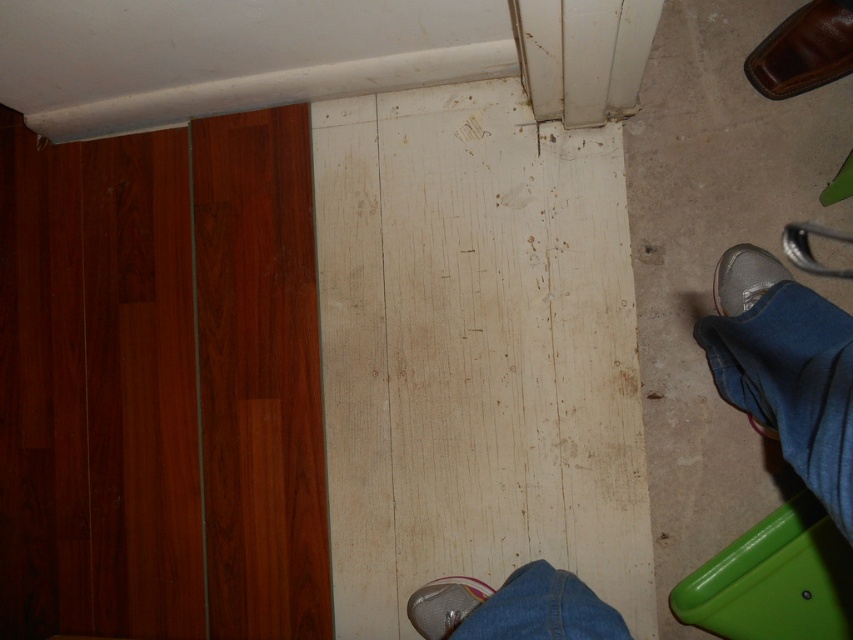
You are a delivery person who needs to place a package between the brown leather shoe at upper right and the silver metallic shoe at lower right. The package is 12 inches long. Will it fit in the space between them?

The distance between the brown leather shoe at upper right and the silver metallic shoe at lower right is 11.18 inches. Since the package is 12 inches long, it will not fit in the space between them.

You are a delivery person standing at the entrance of the room. You need to place a package on the floor between the denim pants at lower right and the metallic silver shoe at lower center. Is there enough space to place the package without touching either item?

The denim pants at lower right and the metallic silver shoe at lower center are 20.24 inches apart. Since the package requires some space to be placed between them, and 20.24 inches is a considerable distance, there is enough space to place the package without touching either item.

You are standing at the center of the image and want to place a new rug that is 1 meter wide between the dark brown wood flooring and the lighter worn wooden floor. Considering the exact position of the denim pants at lower right, will the rug fit without overlapping the denim pants?

The denim pants at lower right are located at point (x=792, y=384). Since the rug is placed between the two flooring types along their meeting edge, which is along the baseboard at the bottom edge of the image, the rug would not overlap the denim pants at lower right as they are positioned further to the lower right corner beyond the rug area.